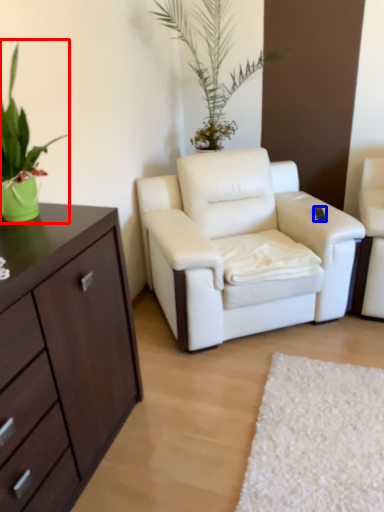
Question: Among these objects, which one is nearest to the camera, houseplant (highlighted by a red box) or remote control (highlighted by a blue box)?

Choices:
 (A) houseplant
 (B) remote control

Answer: (A)